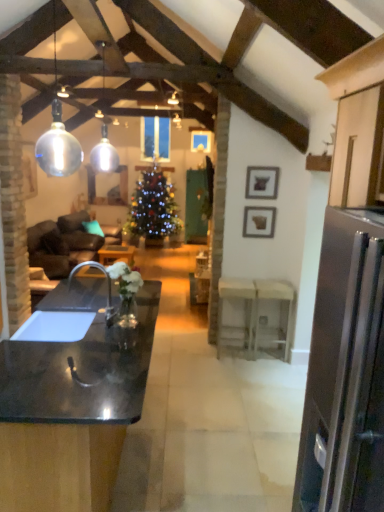
Question: Does wooden picture frame at upper center, which is the second picture frame in back-to-front order, have a smaller size compared to black matte sink at lower left?

Choices:
 (A) no
 (B) yes

Answer: (B)

Question: From the image's perspective, is wooden picture frame at upper center, positioned as the 1th picture frame in front-to-back order, under black matte sink at lower left?

Choices:
 (A) no
 (B) yes

Answer: (A)

Question: Considering the relative sizes of wooden picture frame at upper center, placed as the 2th picture frame when sorted from bottom to top, and black matte sink at lower left in the image provided, is wooden picture frame at upper center, placed as the 2th picture frame when sorted from bottom to top, shorter than black matte sink at lower left?

Choices:
 (A) yes
 (B) no

Answer: (A)

Question: Is wooden picture frame at upper center, placed as the 2th picture frame when sorted from bottom to top, oriented away from black matte sink at lower left?

Choices:
 (A) yes
 (B) no

Answer: (B)

Question: Is wooden picture frame at upper center, the 1th picture frame viewed from the top, not inside black matte sink at lower left?

Choices:
 (A) no
 (B) yes

Answer: (B)

Question: From a real-world perspective, is wooden picture frame at upper center, the 1th picture frame viewed from the top, beneath black matte sink at lower left?

Choices:
 (A) yes
 (B) no

Answer: (B)

Question: Could you tell me if white glossy table at center, positioned as the third table in right-to-left order, is turned towards black matte sink at lower left?

Choices:
 (A) yes
 (B) no

Answer: (B)

Question: Does white glossy table at center, which ranks as the first table in left-to-right order, have a greater width compared to black matte sink at lower left?

Choices:
 (A) no
 (B) yes

Answer: (A)

Question: Does white glossy table at center, the first table in the back-to-front sequence, lie behind black matte sink at lower left?

Choices:
 (A) no
 (B) yes

Answer: (B)

Question: Is white glossy table at center, positioned as the third table in right-to-left order, to the left of black matte sink at lower left from the viewer's perspective?

Choices:
 (A) yes
 (B) no

Answer: (A)

Question: Is white glossy table at center, which ranks as the first table in left-to-right order, placed right next to black matte sink at lower left?

Choices:
 (A) no
 (B) yes

Answer: (A)

Question: Can you confirm if matte gray picture frame at upper right, which ranks as the second picture frame in top-to-bottom order, is shorter than white wood table at center, the 2th table when ordered from left to right?

Choices:
 (A) no
 (B) yes

Answer: (B)